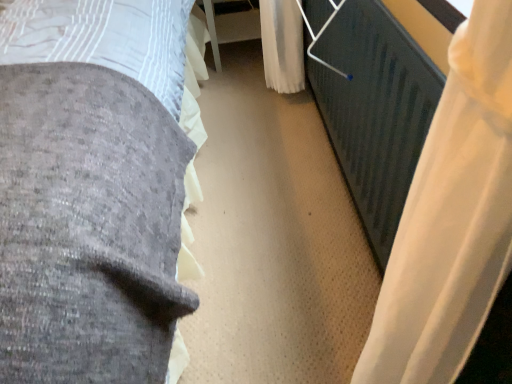
Question: Does white plastic table at center have a greater height compared to white sheer curtain at right?

Choices:
 (A) yes
 (B) no

Answer: (B)

Question: Considering the relative sizes of white plastic table at center and white sheer curtain at right in the image provided, is white plastic table at center bigger than white sheer curtain at right?

Choices:
 (A) yes
 (B) no

Answer: (A)

Question: Considering the relative positions of white plastic table at center and white sheer curtain at right in the image provided, is white plastic table at center to the right of white sheer curtain at right from the viewer's perspective?

Choices:
 (A) yes
 (B) no

Answer: (B)

Question: Can you confirm if white plastic table at center is thinner than white sheer curtain at right?

Choices:
 (A) no
 (B) yes

Answer: (A)

Question: Is white plastic table at center surrounding white sheer curtain at right?

Choices:
 (A) no
 (B) yes

Answer: (A)

Question: Is white sheer curtain at right wider or thinner than white plastic table at center?

Choices:
 (A) thin
 (B) wide

Answer: (A)

Question: Based on their sizes in the image, would you say white sheer curtain at right is bigger or smaller than white plastic table at center?

Choices:
 (A) big
 (B) small

Answer: (B)

Question: From a real-world perspective, is white sheer curtain at right positioned above or below white plastic table at center?

Choices:
 (A) above
 (B) below

Answer: (A)

Question: Is white sheer curtain at right in front of or behind white plastic table at center in the image?

Choices:
 (A) front
 (B) behind

Answer: (A)

Question: From a real-world perspective, is velvet gray bed at left physically located above or below white sheer curtain at right?

Choices:
 (A) below
 (B) above

Answer: (B)

Question: In terms of height, does velvet gray bed at left look taller or shorter compared to white sheer curtain at right?

Choices:
 (A) short
 (B) tall

Answer: (B)

Question: Does point (125, 342) appear closer or farther from the camera than point (435, 137)?

Choices:
 (A) farther
 (B) closer

Answer: (A)

Question: Considering their positions, is velvet gray bed at left located in front of or behind white sheer curtain at right?

Choices:
 (A) behind
 (B) front

Answer: (B)

Question: Looking at the image, does white plastic table at center seem bigger or smaller compared to velvet gray bed at left?

Choices:
 (A) small
 (B) big

Answer: (A)

Question: Looking at their shapes, would you say white plastic table at center is wider or thinner than velvet gray bed at left?

Choices:
 (A) thin
 (B) wide

Answer: (A)